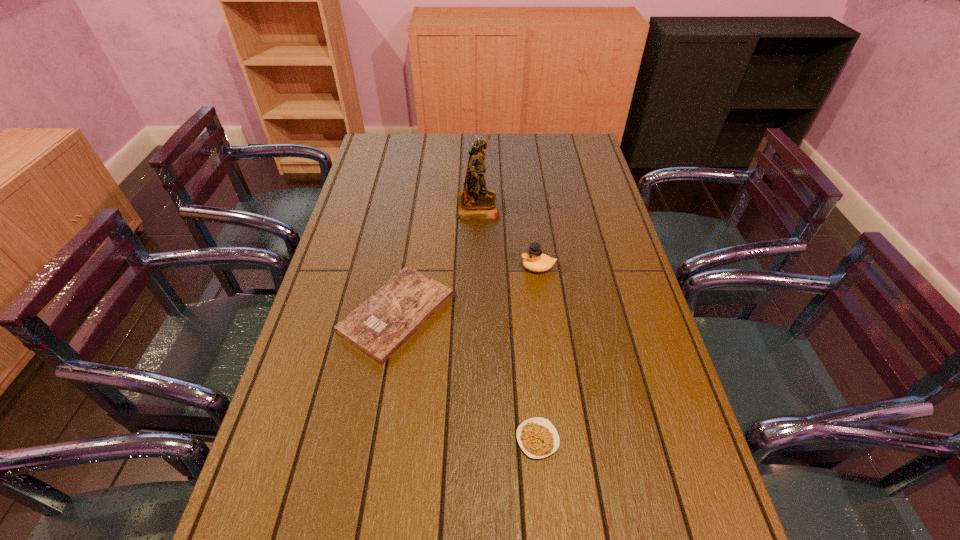
The image size is (960, 540). In order to click on vacant space located 0.060m on the back of the Bible in this screenshot , I will do `click(406, 256)`.

This screenshot has height=540, width=960. Find the location of `free point located on the left of the legume`. free point located on the left of the legume is located at coordinates tap(452, 439).

What are the coordinates of `object that is at the left edge` in the screenshot? It's located at (379, 326).

In the image, there is a desktop. In order to click on vacant region at the far edge in this screenshot , I will do `click(449, 151)`.

The height and width of the screenshot is (540, 960). Find the location of `vacant region at the left edge of the desktop`. vacant region at the left edge of the desktop is located at coordinates (349, 395).

In the image, there is a desktop. Identify the location of vacant space at the right edge. (567, 181).

The height and width of the screenshot is (540, 960). In the image, there is a desktop. In order to click on free space at the far left corner in this screenshot , I will do `click(381, 150)`.

Where is `free space between the Bible and the farthest object`? This screenshot has height=540, width=960. free space between the Bible and the farthest object is located at coordinates pyautogui.click(x=438, y=259).

Locate an element on the screen. The height and width of the screenshot is (540, 960). vacant space that is in between the Bible and the figurine is located at coordinates (438, 259).

You are a GUI agent. You are given a task and a screenshot of the screen. Output one action in this format:
    pyautogui.click(x=<x>, y=<y>)
    Task: Click on the free area in between the figurine and the Bible
    The image size is (960, 540).
    Given the screenshot: What is the action you would take?
    pyautogui.click(x=438, y=259)